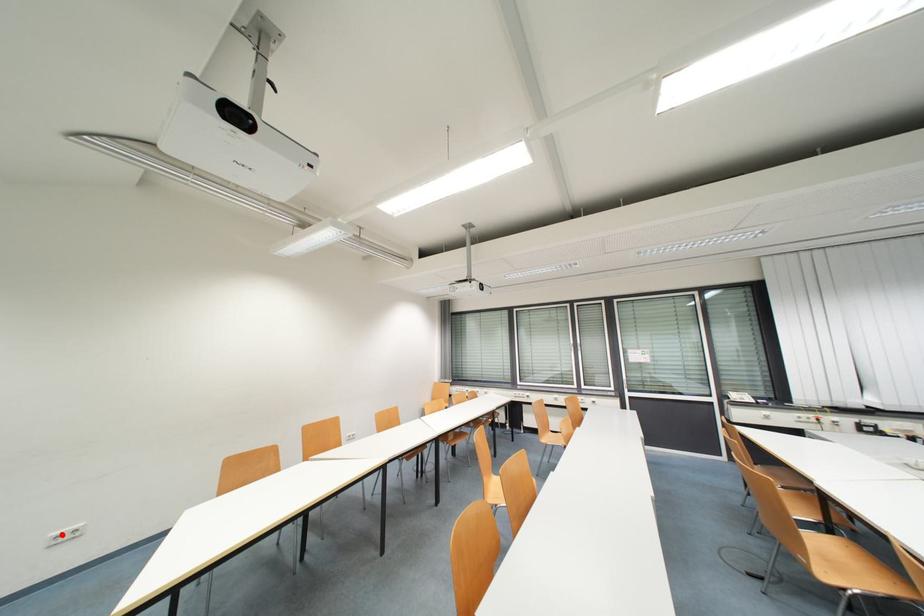
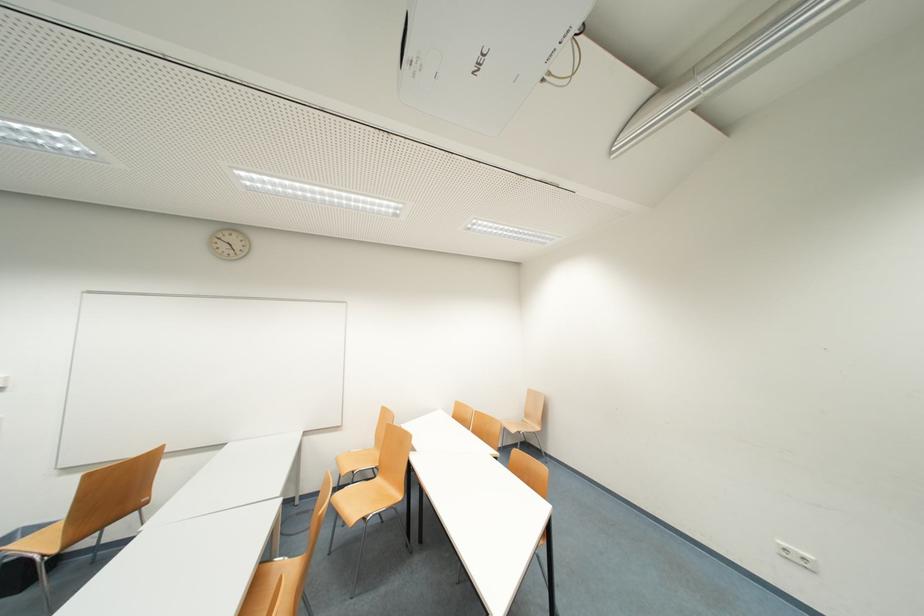
The point at the highlighted location is marked in the first image. Where is the corresponding point in the second image?

(788, 546)